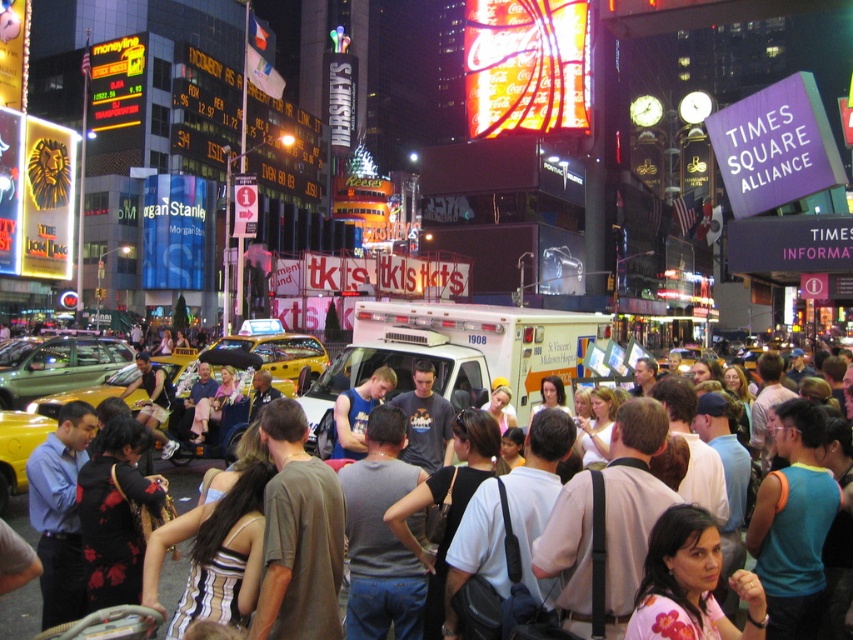
Question: Can you confirm if white matte ambulance at center is positioned to the left of yellow matte taxi at center?

Choices:
 (A) yes
 (B) no

Answer: (B)

Question: Which point appears closest to the camera in this image?

Choices:
 (A) (389, 392)
 (B) (0, 422)
 (C) (166, 570)

Answer: (C)

Question: Which of the following is the closest to the observer?

Choices:
 (A) (498, 77)
 (B) (19, 476)
 (C) (474, 355)

Answer: (B)

Question: Can you confirm if neon glass coca-cola sign at upper center is smaller than yellow matte taxi at center?

Choices:
 (A) yes
 (B) no

Answer: (B)

Question: Is white matte ambulance at center wider than white cotton shirt at center?

Choices:
 (A) no
 (B) yes

Answer: (A)

Question: Which point appears farthest from the camera in this image?

Choices:
 (A) (285, 356)
 (B) (485, 86)
 (C) (167, 602)
 (D) (3, 417)

Answer: (B)